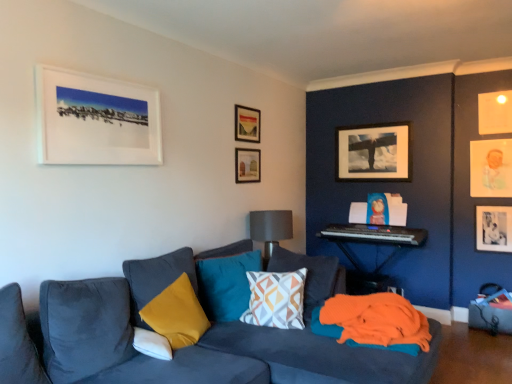
I want to click on free space above matte black picture frame at upper right, placed as the seventh picture frame when sorted from front to back (from a real-world perspective), so click(371, 126).